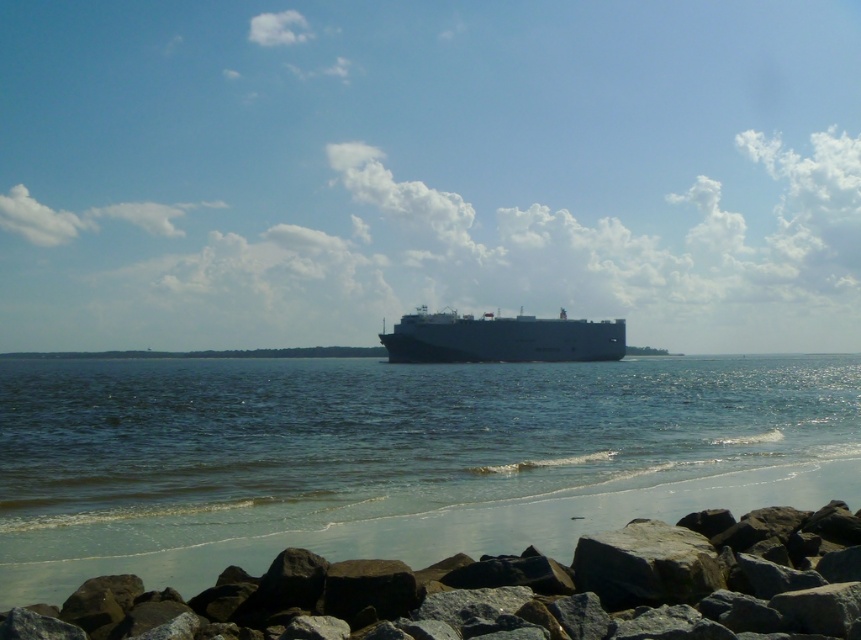
Question: Which point appears closest to the camera in this image?

Choices:
 (A) (53, 611)
 (B) (579, 356)
 (C) (224, 500)

Answer: (A)

Question: Which point is farther to the camera?

Choices:
 (A) (645, 436)
 (B) (376, 563)
 (C) (418, 353)

Answer: (C)

Question: Is blue water at center positioned behind dark gray rock at lower center?

Choices:
 (A) no
 (B) yes

Answer: (B)

Question: Which of the following is the farthest from the observer?

Choices:
 (A) blue water at center
 (B) dark gray rock at lower center

Answer: (A)

Question: Does blue water at center have a lesser width compared to dark gray rock at lower center?

Choices:
 (A) yes
 (B) no

Answer: (B)

Question: Is blue water at center positioned behind dark gray rock at lower center?

Choices:
 (A) no
 (B) yes

Answer: (B)